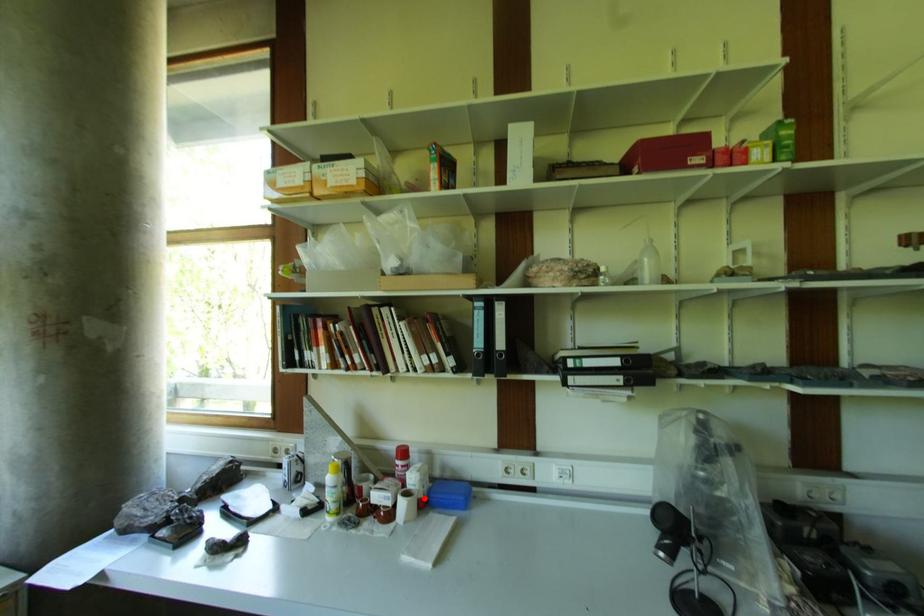
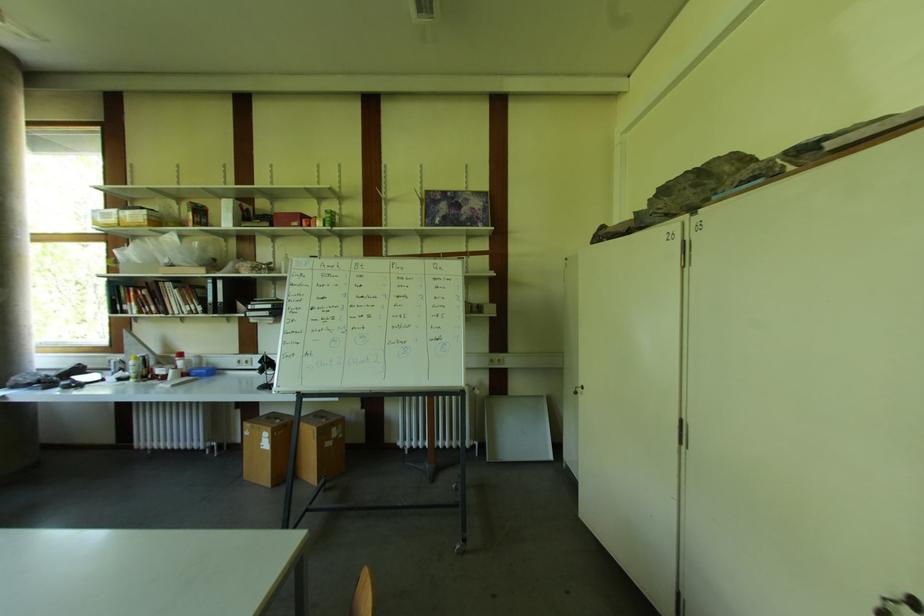
Find the pixel in the second image that matches the highlighted location in the first image.

(188, 373)